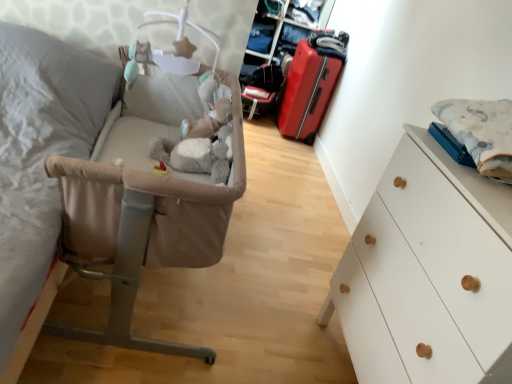
Identify the location of free location to the right of beige fabric infant bed at left. Image resolution: width=512 pixels, height=384 pixels. click(x=272, y=288).